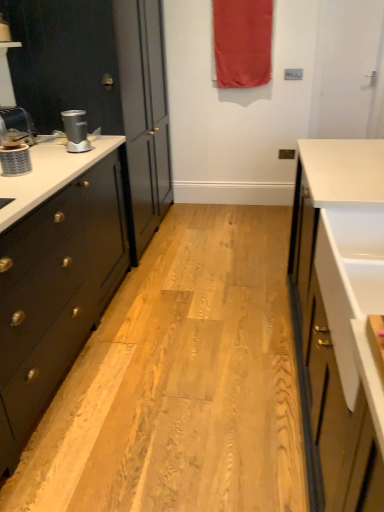
Measure the distance between point (0, 150) and camera.

Point (0, 150) and camera are 5.92 feet apart from each other.

Describe the element at coordinates (242, 42) in the screenshot. I see `red fabric curtain at upper center` at that location.

This screenshot has height=512, width=384. I want to click on silver metallic coffee machine at left, so click(x=75, y=131).

Is silver metallic coffee machine at left positioned before matte black cabinet at left?

Yes, silver metallic coffee machine at left is closer to the camera.

Is point (71, 128) behind point (126, 170)?

No, (71, 128) is in front of (126, 170).

Which is more to the left, silver metallic coffee machine at left or matte black cabinet at left?

Positioned to the left is matte black cabinet at left.

From a real-world perspective, is brushed metal faucet at left positioned under silver metallic coffee machine at left based on gravity?

No.

Measure the distance from brushed metal faucet at left to silver metallic coffee machine at left.

The distance of brushed metal faucet at left from silver metallic coffee machine at left is 12.82 inches.

Is brushed metal faucet at left taller or shorter than silver metallic coffee machine at left?

Clearly, brushed metal faucet at left is taller compared to silver metallic coffee machine at left.

Does brushed metal faucet at left turn towards silver metallic coffee machine at left?

Yes, brushed metal faucet at left is aimed at silver metallic coffee machine at left.

From a real-world perspective, is matte black cabinet at left below red fabric curtain at upper center?

Indeed, from a real-world perspective, matte black cabinet at left is positioned beneath red fabric curtain at upper center.

Based on the photo, are matte black cabinet at left and red fabric curtain at upper center far apart?

Yes, matte black cabinet at left is far from red fabric curtain at upper center.

Does point (156, 9) appear closer or farther from the camera than point (232, 46)?

Point (156, 9) appears to be closer to the viewer than point (232, 46).

From the image's perspective, between red fabric curtain at upper center and matte silver blender at left, who is located below?

matte silver blender at left is shown below in the image.

Is point (246, 24) in front of point (8, 149)?

No, (246, 24) is behind (8, 149).

Does red fabric curtain at upper center come behind matte silver blender at left?

Yes, the depth of red fabric curtain at upper center is greater than that of matte silver blender at left.

From a real-world perspective, is red fabric curtain at upper center located beneath matte silver blender at left?

No.

From a real-world perspective, who is located higher, matte black cabinet at left or matte silver blender at left?

In real-world perspective, matte silver blender at left is above.

Based on the photo, which object is further away from the camera taking this photo, matte black cabinet at left or matte silver blender at left?

matte black cabinet at left is further away from the camera.

Between matte black cabinet at left and matte silver blender at left, which one has smaller width?

With smaller width is matte silver blender at left.

Considering the points (154, 122) and (29, 169), which point is behind, point (154, 122) or point (29, 169)?

Positioned behind is point (154, 122).

Which is farther, [34,135] or [228,1]?

The point [228,1] is farther.

From the image's perspective, is brushed metal faucet at left located beneath red fabric curtain at upper center?

Correct, brushed metal faucet at left appears lower than red fabric curtain at upper center in the image.

You are a GUI agent. You are given a task and a screenshot of the screen. Output one action in this format:
    pyautogui.click(x=<x>, y=<y>)
    Task: Click on the curtain above the brushed metal faucet at left (from the image's perspective)
    Image resolution: width=384 pixels, height=512 pixels.
    Given the screenshot: What is the action you would take?
    pyautogui.click(x=242, y=42)

Considering the positions of objects matte silver blender at left and brushed metal faucet at left in the image provided, who is behind, matte silver blender at left or brushed metal faucet at left?

Positioned behind is brushed metal faucet at left.

In the image, is matte silver blender at left on the left side or the right side of brushed metal faucet at left?

From the image, it's evident that matte silver blender at left is to the right of brushed metal faucet at left.

Considering the relative sizes of matte silver blender at left and brushed metal faucet at left in the image provided, is matte silver blender at left wider than brushed metal faucet at left?

Incorrect, the width of matte silver blender at left does not surpass that of brushed metal faucet at left.

Is matte silver blender at left looking in the opposite direction of brushed metal faucet at left?

No, matte silver blender at left's orientation is not away from brushed metal faucet at left.

Locate an element on the screen. This screenshot has width=384, height=512. coffee machine positioned vertically above the matte black cabinet at left (from a real-world perspective) is located at coordinates (75, 131).

Find the location of a particular element. faucet above the silver metallic coffee machine at left (from the image's perspective) is located at coordinates (16, 125).

Looking at the image, which one is located further to red fabric curtain at upper center, brushed metal faucet at left or silver metallic coffee machine at left?

brushed metal faucet at left lies further to red fabric curtain at upper center than the other object.

Considering their positions, is red fabric curtain at upper center positioned further to silver metallic coffee machine at left than matte silver blender at left?

Among the two, red fabric curtain at upper center is located further to silver metallic coffee machine at left.

When comparing their distances from matte silver blender at left, does silver metallic coffee machine at left or red fabric curtain at upper center seem further?

red fabric curtain at upper center lies further to matte silver blender at left than the other object.

From the image, which object appears to be farther from matte black cabinet at left, brushed metal faucet at left or matte silver blender at left?

Among the two, matte silver blender at left is located further to matte black cabinet at left.

From the image, which object appears to be nearer to silver metallic coffee machine at left, brushed metal faucet at left or matte silver blender at left?

Among the two, brushed metal faucet at left is located nearer to silver metallic coffee machine at left.

Based on their spatial positions, is silver metallic coffee machine at left or red fabric curtain at upper center further from matte black cabinet at left?

red fabric curtain at upper center lies further to matte black cabinet at left than the other object.

Estimate the real-world distances between objects in this image. Which object is closer to brushed metal faucet at left, red fabric curtain at upper center or matte silver blender at left?

matte silver blender at left is closer to brushed metal faucet at left.

From the image, which object appears to be farther from red fabric curtain at upper center, brushed metal faucet at left or matte black cabinet at left?

brushed metal faucet at left lies further to red fabric curtain at upper center than the other object.

Identify the location of cabinetry located between matte silver blender at left and red fabric curtain at upper center in the depth direction. Image resolution: width=384 pixels, height=512 pixels. (101, 87).

Identify the location of appliance between brushed metal faucet at left and silver metallic coffee machine at left in the horizontal direction. (15, 159).

Find the location of a particular element. The height and width of the screenshot is (512, 384). cabinetry between brushed metal faucet at left and red fabric curtain at upper center is located at coordinates (101, 87).

Locate an element on the screen. The height and width of the screenshot is (512, 384). coffee machine between brushed metal faucet at left and red fabric curtain at upper center from left to right is located at coordinates (75, 131).